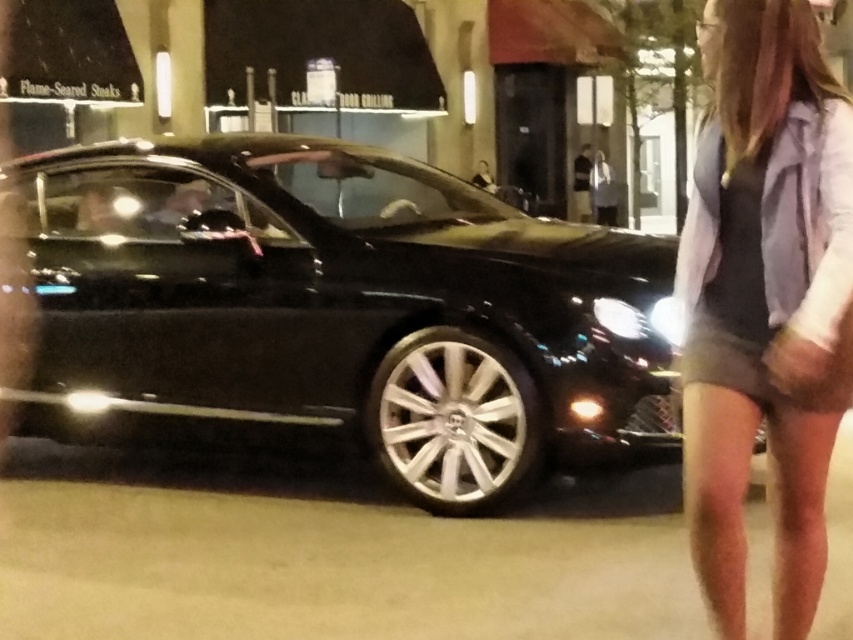
Does point (520, 330) lie behind point (782, 170)?

Yes, it is.

Is shiny black car at center wider than gray fabric shorts at lower right?

Indeed, shiny black car at center has a greater width compared to gray fabric shorts at lower right.

Which is behind, point (65, 384) or point (728, 627)?

The point (65, 384) is behind.

Find the location of a particular element. This screenshot has width=853, height=640. shiny black car at center is located at coordinates (335, 308).